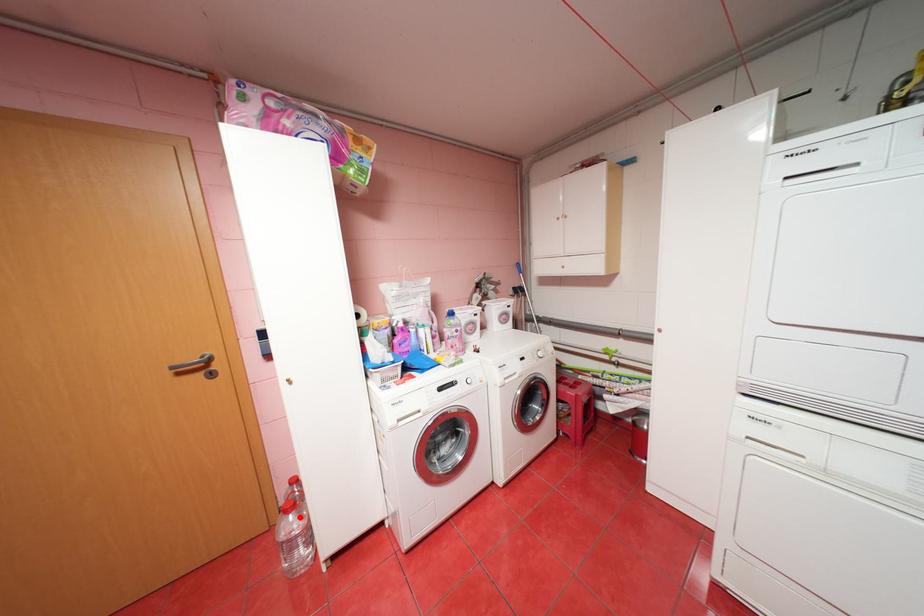
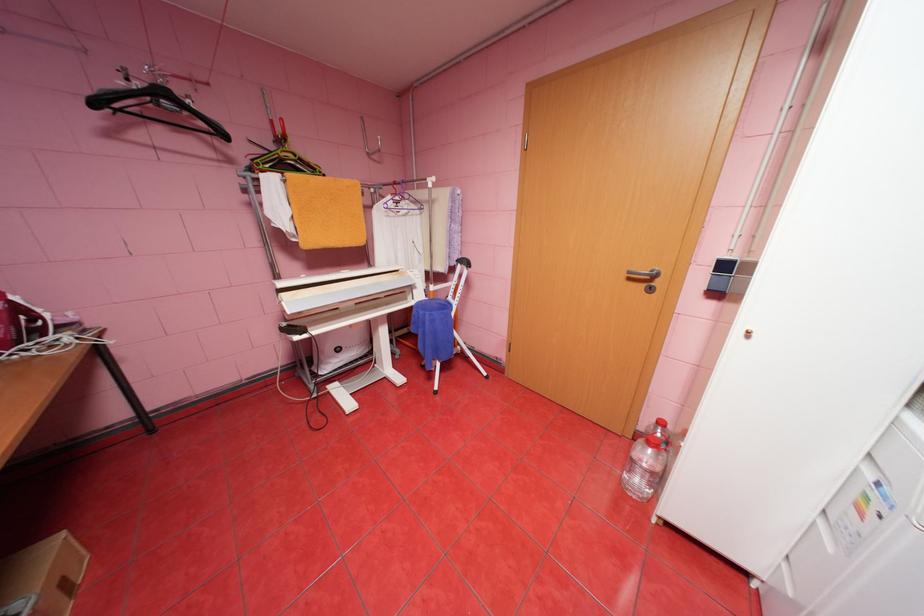
Question: I am providing you with two images of the same scene from different viewpoints. Given a red point in image1, look at the same physical point in image2. Is it:

Choices:
 (A) Closer to the viewpoint
 (B) Farther from the viewpoint

Answer: (A)